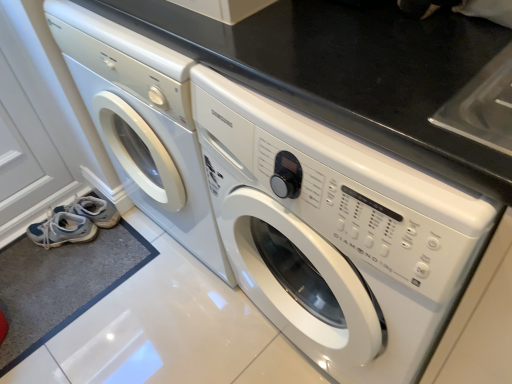
Identify the location of vacant space to the right of light blue fabric shoe at lower left, the 2th shoe viewed from the top. point(118,247).